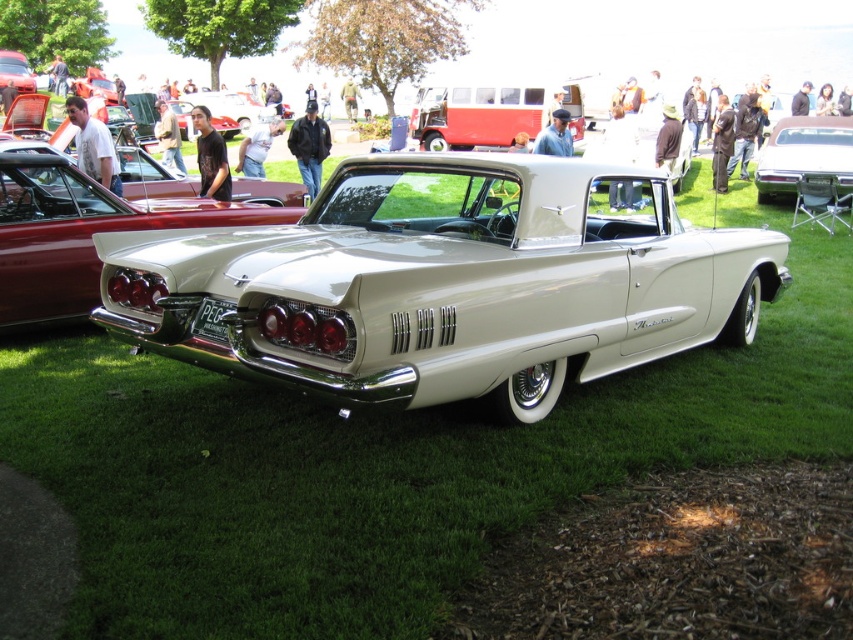
Question: Which object is farther from the camera taking this photo?

Choices:
 (A) red matte van at upper center
 (B) shiny white convertible at center

Answer: (A)

Question: Is shiny white car at center below shiny silver car at upper right?

Choices:
 (A) no
 (B) yes

Answer: (B)

Question: Is shiny white car at center below shiny silver car at upper right?

Choices:
 (A) yes
 (B) no

Answer: (A)

Question: Which point is closer to the camera?

Choices:
 (A) shiny white convertible at center
 (B) shiny silver car at upper right
 (C) shiny white car at center
 (D) red matte van at upper center

Answer: (A)

Question: Can you confirm if shiny white convertible at center is positioned to the right of shiny white car at center?

Choices:
 (A) no
 (B) yes

Answer: (B)

Question: Among these points, which one is nearest to the camera?

Choices:
 (A) (846, 131)
 (B) (306, 246)

Answer: (B)